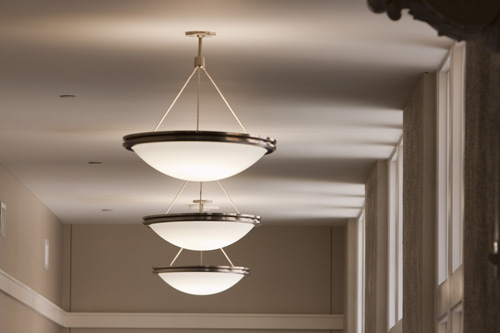
I want to click on light attachments to ceiling, so point(202,31), point(204,200).